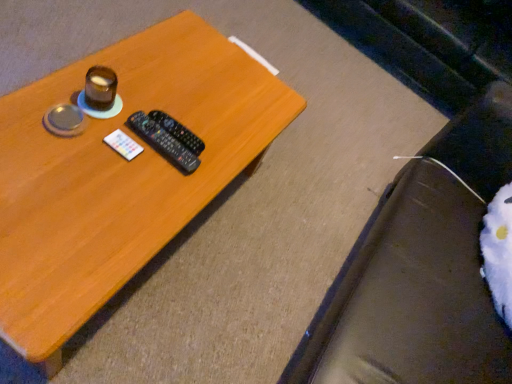
What are the coordinates of `vacant space in front of black plastic remote at center, placed as the second remote control when sorted from back to front` in the screenshot? It's located at (117, 185).